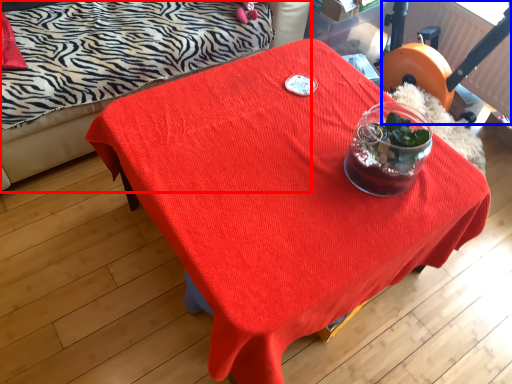
Question: Which object is closer to the camera taking this photo, studio couch (highlighted by a red box) or swivel chair (highlighted by a blue box)?

Choices:
 (A) studio couch
 (B) swivel chair

Answer: (A)